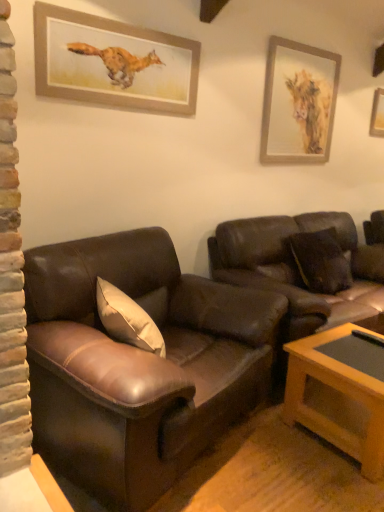
At what (x,y) coordinates should I click in order to perform the action: click on free spot above wooden picture frame at upper left, the 3th picture frame in the right-to-left sequence (from a real-world perspective). Please return your answer as a coordinate pair (x, y). This screenshot has width=384, height=512. Looking at the image, I should click on (129, 23).